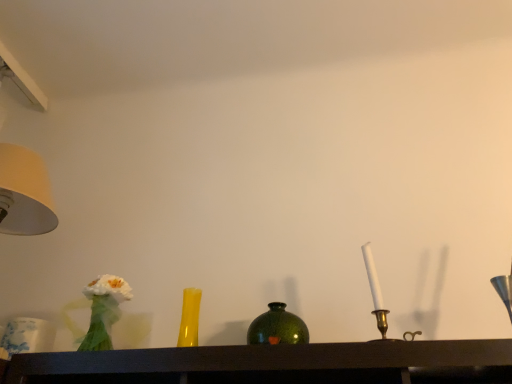
The image size is (512, 384). What are the coordinates of `green glass vase at center` in the screenshot? It's located at pos(277,327).

The image size is (512, 384). I want to click on matte yellow glass vase at center, so click(x=189, y=318).

The height and width of the screenshot is (384, 512). Describe the element at coordinates (376, 295) in the screenshot. I see `white porcelain candle at right` at that location.

At what (x,y) coordinates should I click in order to perform the action: click on white porcelain candle at right. Please return your answer as a coordinate pair (x, y). This screenshot has height=384, width=512. Looking at the image, I should click on (376, 295).

Locate an element on the screen. white fabric flower at left is located at coordinates (104, 310).

Does white fabric flower at left have a greater height compared to matte yellow glass vase at center?

Yes, white fabric flower at left is taller than matte yellow glass vase at center.

From the image's perspective, is white fabric flower at left above matte yellow glass vase at center?

Yes, from the image's perspective, white fabric flower at left is on top of matte yellow glass vase at center.

Which object is further away from the camera, white fabric flower at left or matte yellow glass vase at center?

matte yellow glass vase at center is further from the camera.

How much distance is there between matte yellow glass vase at center and white porcelain candle at right?

matte yellow glass vase at center is 21.09 inches from white porcelain candle at right.

Between matte yellow glass vase at center and white porcelain candle at right, which one has larger size?

Bigger between the two is matte yellow glass vase at center.

In terms of height, does matte yellow glass vase at center look taller or shorter compared to white porcelain candle at right?

Clearly, matte yellow glass vase at center is shorter compared to white porcelain candle at right.

Which is more to the right, matte yellow glass vase at center or white porcelain candle at right?

From the viewer's perspective, white porcelain candle at right appears more on the right side.

Which of these two, white porcelain candle at right or white fabric flower at left, is smaller?

white porcelain candle at right.

Is white porcelain candle at right positioned far away from white fabric flower at left?

They are positioned close to each other.

From the picture: Does white porcelain candle at right appear on the left side of white fabric flower at left?

No, white porcelain candle at right is not to the left of white fabric flower at left.

Do you think white fabric flower at left is within green glass vase at center, or outside of it?

white fabric flower at left cannot be found inside green glass vase at center.

Which is in front, white fabric flower at left or green glass vase at center?

white fabric flower at left is closer to the camera.

Is white fabric flower at left aimed at green glass vase at center?

No, white fabric flower at left is not oriented towards green glass vase at center.

Considering the sizes of objects white fabric flower at left and white porcelain candle at right in the image provided, who is thinner, white fabric flower at left or white porcelain candle at right?

white porcelain candle at right.

Is white porcelain candle at right located within white fabric flower at left?

No, white porcelain candle at right is not surrounded by white fabric flower at left.

Who is shorter, white fabric flower at left or white porcelain candle at right?

Standing shorter between the two is white fabric flower at left.

Relative to white fabric flower at left, is green glass vase at center in front or behind?

green glass vase at center is behind white fabric flower at left.

From a real-world perspective, who is located higher, green glass vase at center or white fabric flower at left?

In real-world perspective, white fabric flower at left is above.

Considering the relative sizes of green glass vase at center and white fabric flower at left in the image provided, is green glass vase at center wider than white fabric flower at left?

No, green glass vase at center is not wider than white fabric flower at left.

Is green glass vase at center far from white porcelain candle at right?

green glass vase at center is actually quite close to white porcelain candle at right.

Is white porcelain candle at right inside green glass vase at center?

That's incorrect, white porcelain candle at right is not inside green glass vase at center.

Does green glass vase at center turn towards white porcelain candle at right?

No, green glass vase at center does not turn towards white porcelain candle at right.

Locate an element on the screen. vase that appears on the right of white fabric flower at left is located at coordinates (189, 318).

Where is `vase below the white porcelain candle at right (from the image's perspective)`? Image resolution: width=512 pixels, height=384 pixels. vase below the white porcelain candle at right (from the image's perspective) is located at coordinates (189, 318).

When comparing their distances from white porcelain candle at right, does white fabric flower at left or green glass vase at center seem further?

white fabric flower at left is positioned further to the anchor white porcelain candle at right.

Which object lies further to the anchor point white porcelain candle at right, white fabric flower at left or matte yellow glass vase at center?

white fabric flower at left is positioned further to the anchor white porcelain candle at right.

Based on their spatial positions, is green glass vase at center or matte yellow glass vase at center closer to white fabric flower at left?

matte yellow glass vase at center lies closer to white fabric flower at left than the other object.

From the image, which object appears to be nearer to white fabric flower at left, matte yellow glass vase at center or green glass vase at center?

matte yellow glass vase at center is positioned closer to the anchor white fabric flower at left.

Looking at this image, when comparing their distances from white fabric flower at left, does green glass vase at center or white porcelain candle at right seem closer?

green glass vase at center lies closer to white fabric flower at left than the other object.

When comparing their distances from matte yellow glass vase at center, does white fabric flower at left or white porcelain candle at right seem further?

white porcelain candle at right lies further to matte yellow glass vase at center than the other object.

Which object lies nearer to the anchor point white porcelain candle at right, matte yellow glass vase at center or green glass vase at center?

green glass vase at center is positioned closer to the anchor white porcelain candle at right.

Considering their positions, is green glass vase at center positioned further to white porcelain candle at right than matte yellow glass vase at center?

matte yellow glass vase at center lies further to white porcelain candle at right than the other object.

The width and height of the screenshot is (512, 384). Find the location of `vase between white fabric flower at left and green glass vase at center in the horizontal direction`. vase between white fabric flower at left and green glass vase at center in the horizontal direction is located at coordinates (189, 318).

Identify the location of vase situated between white fabric flower at left and white porcelain candle at right from left to right. (189, 318).

Identify the location of bottle situated between matte yellow glass vase at center and white porcelain candle at right from left to right. (277, 327).

You are a GUI agent. You are given a task and a screenshot of the screen. Output one action in this format:
    pyautogui.click(x=<x>, y=<y>)
    Task: Click on the bottle between white fabric flower at left and white porcelain candle at right in the horizontal direction
    
    Given the screenshot: What is the action you would take?
    pyautogui.click(x=277, y=327)